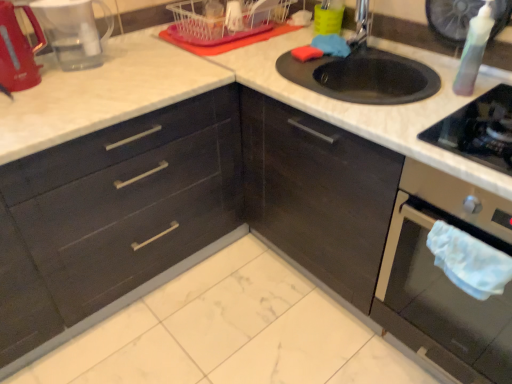
Locate an element on the screen. Image resolution: width=512 pixels, height=384 pixels. free space in front of metallic red kettle at left, which is the second appliance from right to left is located at coordinates (26, 103).